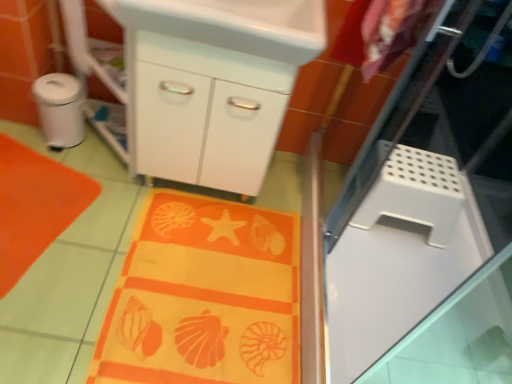
Question: Is the depth of orange fabric beach towel at lower left greater than that of white perforated screen door at right?

Choices:
 (A) yes
 (B) no

Answer: (A)

Question: Is orange fabric beach towel at lower left closer to the viewer compared to white perforated screen door at right?

Choices:
 (A) no
 (B) yes

Answer: (A)

Question: Is orange fabric beach towel at lower left shorter than white perforated screen door at right?

Choices:
 (A) no
 (B) yes

Answer: (B)

Question: Is orange fabric beach towel at lower left facing towards white perforated screen door at right?

Choices:
 (A) yes
 (B) no

Answer: (A)

Question: From the image's perspective, is orange fabric beach towel at lower left above white perforated screen door at right?

Choices:
 (A) yes
 (B) no

Answer: (B)

Question: Based on their sizes in the image, would you say white glossy sink at upper center is bigger or smaller than white glossy cabinet at center?

Choices:
 (A) small
 (B) big

Answer: (A)

Question: From a real-world perspective, is white glossy sink at upper center above or below white glossy cabinet at center?

Choices:
 (A) below
 (B) above

Answer: (B)

Question: Considering the positions of white glossy sink at upper center and white glossy cabinet at center in the image, is white glossy sink at upper center taller or shorter than white glossy cabinet at center?

Choices:
 (A) short
 (B) tall

Answer: (A)

Question: From the image's perspective, is white glossy sink at upper center positioned above or below white glossy cabinet at center?

Choices:
 (A) above
 (B) below

Answer: (A)

Question: Considering the positions of white glossy sink at upper center and white plastic step stool at right, which ranks as the second appliance in left-to-right order, in the image, is white glossy sink at upper center wider or thinner than white plastic step stool at right, which ranks as the second appliance in left-to-right order,?

Choices:
 (A) wide
 (B) thin

Answer: (A)

Question: Is white glossy sink at upper center to the left or to the right of white plastic step stool at right, which is counted as the first appliance, starting from the right, in the image?

Choices:
 (A) left
 (B) right

Answer: (A)

Question: From the image's perspective, is white glossy sink at upper center located above or below white plastic step stool at right, the 1th appliance from the bottom?

Choices:
 (A) above
 (B) below

Answer: (A)

Question: Considering the positions of point (123, 0) and point (455, 208), is point (123, 0) closer or farther from the camera than point (455, 208)?

Choices:
 (A) farther
 (B) closer

Answer: (B)

Question: Is point (387, 168) positioned closer to the camera than point (71, 100)?

Choices:
 (A) farther
 (B) closer

Answer: (B)

Question: From a real-world perspective, is white plastic step stool at right, the 1th appliance from the bottom, above or below white plastic trash can at left, which is the second appliance in bottom-to-top order?

Choices:
 (A) below
 (B) above

Answer: (B)